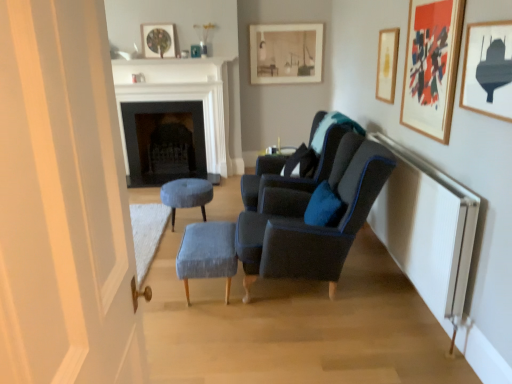
The image size is (512, 384). What do you see at coordinates (426, 229) in the screenshot? I see `white textured radiator at right` at bounding box center [426, 229].

In order to face velvet grey stool at center, arranged as the second stool when viewed from the front, should I rotate leftwards or rightwards?

To face it directly, rotate left by 8.953 degrees.

This screenshot has width=512, height=384. What do you see at coordinates (63, 202) in the screenshot? I see `white fabric curtain at left` at bounding box center [63, 202].

The image size is (512, 384). What do you see at coordinates (184, 99) in the screenshot?
I see `white marble fireplace at center, which appears as the 1th fireplace when viewed from the front` at bounding box center [184, 99].

At what (x,y) coordinates should I click in order to perform the action: click on gold metallic picture frame at upper right, the 3th picture frame positioned from the back. Please return your answer as a coordinate pair (x, y). Looking at the image, I should click on (387, 64).

In terms of size, does matte black side table at center appear bigger or smaller than matte black picture frame at upper center, which appears as the 1th picture frame when viewed from the left?

matte black side table at center is bigger than matte black picture frame at upper center, which appears as the 1th picture frame when viewed from the left.

Is matte black picture frame at upper center, which is the 2th picture frame in back-to-front order, inside matte black side table at center?

Actually, matte black picture frame at upper center, which is the 2th picture frame in back-to-front order, is outside matte black side table at center.

Which point is more forward, (x=267, y=168) or (x=160, y=39)?

The point (x=267, y=168) is closer.

From a real-world perspective, between matte black side table at center and matte black picture frame at upper center, which ranks as the fourth picture frame in front-to-back order, who is vertically lower?

matte black side table at center is physically lower.

Could you measure the distance between velvet dark blue armchair at center, positioned as the 1th chair in back-to-front order, and white marble fireplace at center, which appears as the 1th fireplace when viewed from the front?

Result: velvet dark blue armchair at center, positioned as the 1th chair in back-to-front order, is 2.26 meters away from white marble fireplace at center, which appears as the 1th fireplace when viewed from the front.

Is point (255, 199) closer to camera compared to point (131, 93)?

Yes, point (255, 199) is closer to viewer.

Is the depth of velvet dark blue armchair at center, marked as the 2th chair in a front-to-back arrangement, greater than that of white marble fireplace at center, which appears as the 1th fireplace when viewed from the front?

No, velvet dark blue armchair at center, marked as the 2th chair in a front-to-back arrangement, is closer to the viewer.

Consider the image. From a real-world perspective, between velvet dark blue armchair at center, marked as the 2th chair in a front-to-back arrangement, and white marble fireplace at center, which appears as the 1th fireplace when viewed from the front, who is vertically lower?

velvet dark blue armchair at center, marked as the 2th chair in a front-to-back arrangement, is physically lower.

Is matte gold picture frame at upper right, placed as the fourth picture frame when sorted from left to right, turned away from velvet dark blue armchair at center, arranged as the 1th chair when viewed from the front?

No.

Is matte gold picture frame at upper right, the fourth picture frame when ordered from back to front, bigger than velvet dark blue armchair at center, arranged as the 1th chair when viewed from the front?

No, matte gold picture frame at upper right, the fourth picture frame when ordered from back to front, is not bigger than velvet dark blue armchair at center, arranged as the 1th chair when viewed from the front.

Between matte gold picture frame at upper right, acting as the second picture frame starting from the right, and velvet dark blue armchair at center, the 2th chair in the back-to-front sequence, which one has less height?

With less height is matte gold picture frame at upper right, acting as the second picture frame starting from the right.

Which chair is the 1st one when counting from the left side of the matte gold picture frame at upper right, acting as the second picture frame starting from the right? Please provide its 2D coordinates.

[(308, 225)]

Considering the positions of objects velvet grey stool at center, arranged as the second stool when viewed from the front, and white marble fireplace at center, which appears as the 1th fireplace when viewed from the front, in the image provided, who is more to the right, velvet grey stool at center, arranged as the second stool when viewed from the front, or white marble fireplace at center, which appears as the 1th fireplace when viewed from the front,?

From the viewer's perspective, velvet grey stool at center, arranged as the second stool when viewed from the front, appears more on the right side.

Considering the sizes of velvet grey stool at center, arranged as the second stool when viewed from the front, and white marble fireplace at center, the 2th fireplace in the back-to-front sequence, in the image, is velvet grey stool at center, arranged as the second stool when viewed from the front, taller or shorter than white marble fireplace at center, the 2th fireplace in the back-to-front sequence,?

velvet grey stool at center, arranged as the second stool when viewed from the front, is shorter than white marble fireplace at center, the 2th fireplace in the back-to-front sequence.

Identify the location of the 2nd fireplace above when counting from the velvet grey stool at center, arranged as the first stool when viewed from the back (from the image's perspective). (184, 99).

From the image's perspective, is velvet grey stool at center, arranged as the second stool when viewed from the front, beneath white marble fireplace at center, which appears as the 1th fireplace when viewed from the front?

Yes, from the image's perspective, velvet grey stool at center, arranged as the second stool when viewed from the front, is beneath white marble fireplace at center, which appears as the 1th fireplace when viewed from the front.

Does point (190, 178) come farther from viewer compared to point (490, 93)?

Yes, it is.

Does velvet grey stool at center, arranged as the first stool when viewed from the back, have a larger size compared to matte black submarine at upper right, which is the 5th picture frame from left to right?

Indeed, velvet grey stool at center, arranged as the first stool when viewed from the back, has a larger size compared to matte black submarine at upper right, which is the 5th picture frame from left to right.

How many degrees apart are the facing directions of velvet grey stool at center, arranged as the first stool when viewed from the back, and matte black submarine at upper right, the 1th picture frame viewed from the front?

0.00397 degrees separate the facing orientations of velvet grey stool at center, arranged as the first stool when viewed from the back, and matte black submarine at upper right, the 1th picture frame viewed from the front.

From the image's perspective, which is above, velvet grey stool at center, arranged as the second stool when viewed from the front, or matte black submarine at upper right, acting as the fifth picture frame starting from the back?

matte black submarine at upper right, acting as the fifth picture frame starting from the back.

Based on the photo, can you confirm if gold metallic picture frame at upper right, which is counted as the 3th picture frame, starting from the right, is taller than velvet dark blue armchair at center, the 2th chair in the back-to-front sequence?

In fact, gold metallic picture frame at upper right, which is counted as the 3th picture frame, starting from the right, may be shorter than velvet dark blue armchair at center, the 2th chair in the back-to-front sequence.

Locate an element on the screen. This screenshot has height=384, width=512. the 3rd picture frame positioned above the velvet dark blue armchair at center, arranged as the 1th chair when viewed from the front (from the image's perspective) is located at coordinates (387, 64).

From the image's perspective, which object appears higher, gold metallic picture frame at upper right, the 3th picture frame positioned from the back, or velvet dark blue armchair at center, the 2th chair in the back-to-front sequence?

gold metallic picture frame at upper right, the 3th picture frame positioned from the back, appears higher in the image.

Would you consider gold metallic picture frame at upper right, the 3th picture frame when ordered from left to right, to be distant from velvet dark blue armchair at center, the 2th chair in the back-to-front sequence?

That's right, there is a large distance between gold metallic picture frame at upper right, the 3th picture frame when ordered from left to right, and velvet dark blue armchair at center, the 2th chair in the back-to-front sequence.

From the image's perspective, who appears lower, white fabric curtain at left or velvet dark blue armchair at center, marked as the 2th chair in a front-to-back arrangement?

white fabric curtain at left.

Between point (11, 6) and point (322, 124), which one is positioned behind?

The point (322, 124) is behind.

Consider the image. Would you say white fabric curtain at left is to the left or to the right of velvet dark blue armchair at center, positioned as the 1th chair in back-to-front order, in the picture?

From the image, it's evident that white fabric curtain at left is to the left of velvet dark blue armchair at center, positioned as the 1th chair in back-to-front order.

What are the coordinates of `side table below the matte black picture frame at upper center, which appears as the 1th picture frame when viewed from the left (from a real-world perspective)` in the screenshot? It's located at (273, 160).

Identify the location of the 1st chair in front of the white marble fireplace at center, which appears as the 1th fireplace when viewed from the front. This screenshot has width=512, height=384. (307, 159).

Consider the image. Based on their spatial positions, is white marble fireplace at center, which appears as the 1th fireplace when viewed from the front, or white fabric curtain at left further from matte gold picture frame at upper right, placed as the fourth picture frame when sorted from left to right?

Among the two, white marble fireplace at center, which appears as the 1th fireplace when viewed from the front, is located further to matte gold picture frame at upper right, placed as the fourth picture frame when sorted from left to right.

Based on their spatial positions, is white marble fireplace at center, which appears as the 1th fireplace when viewed from the front, or gold metallic picture frame at upper right, the 3th picture frame positioned from the back, closer to white fabric curtain at left?

gold metallic picture frame at upper right, the 3th picture frame positioned from the back, is positioned closer to the anchor white fabric curtain at left.

Looking at the image, which one is located further to velvet grey stool at center, arranged as the first stool when viewed from the back, velvet dark blue armchair at center, the 2th chair in the back-to-front sequence, or matte paper picture frame at upper center, the first picture frame positioned from the back?

matte paper picture frame at upper center, the first picture frame positioned from the back, is positioned further to the anchor velvet grey stool at center, arranged as the first stool when viewed from the back.

Based on their spatial positions, is matte paper picture frame at upper center, which appears as the second picture frame when viewed from the left, or light blue fabric stool at center, positioned as the 1th stool in front-to-back order, further from matte black submarine at upper right, the 1th picture frame viewed from the front?

matte paper picture frame at upper center, which appears as the second picture frame when viewed from the left, is positioned further to the anchor matte black submarine at upper right, the 1th picture frame viewed from the front.

Looking at the image, which one is located closer to matte paper picture frame at upper center, the first picture frame positioned from the back, matte black submarine at upper right, which appears as the 1th picture frame when viewed from the right, or velvet dark blue armchair at center, marked as the 2th chair in a front-to-back arrangement?

velvet dark blue armchair at center, marked as the 2th chair in a front-to-back arrangement, is positioned closer to the anchor matte paper picture frame at upper center, the first picture frame positioned from the back.

Considering their positions, is light blue fabric stool at center, which is counted as the 2th stool, starting from the back, positioned further to white marble fireplace at center, which appears as the 1th fireplace when viewed from the front, than velvet dark blue armchair at center, arranged as the 1th chair when viewed from the front?

light blue fabric stool at center, which is counted as the 2th stool, starting from the back, is further to white marble fireplace at center, which appears as the 1th fireplace when viewed from the front.

When comparing their distances from white fabric curtain at left, does matte paper picture frame at upper center, which appears as the second picture frame when viewed from the left, or white marble fireplace at center, the 2th fireplace in the back-to-front sequence, seem further?

matte paper picture frame at upper center, which appears as the second picture frame when viewed from the left, lies further to white fabric curtain at left than the other object.

Looking at the image, which one is located further to matte black side table at center, velvet dark blue armchair at center, the 2th chair in the back-to-front sequence, or velvet grey stool at center, arranged as the first stool when viewed from the back?

Based on the image, velvet dark blue armchair at center, the 2th chair in the back-to-front sequence, appears to be further to matte black side table at center.

Where is `chair between white fabric curtain at left and light blue fabric stool at center, positioned as the 1th stool in front-to-back order, in the front-back direction`? chair between white fabric curtain at left and light blue fabric stool at center, positioned as the 1th stool in front-to-back order, in the front-back direction is located at coordinates (308, 225).

Locate an element on the screen. This screenshot has width=512, height=384. side table between matte black submarine at upper right, acting as the fifth picture frame starting from the back, and matte paper picture frame at upper center, the fourth picture frame in the right-to-left sequence, from front to back is located at coordinates (273, 160).

Where is `picture frame between velvet dark blue armchair at center, marked as the 2th chair in a front-to-back arrangement, and dark gray stone fireplace at center, which appears as the 1th fireplace when viewed from the back, in the front-back direction`? This screenshot has width=512, height=384. picture frame between velvet dark blue armchair at center, marked as the 2th chair in a front-to-back arrangement, and dark gray stone fireplace at center, which appears as the 1th fireplace when viewed from the back, in the front-back direction is located at coordinates (158, 40).

At what (x,y) coordinates should I click in order to perform the action: click on picture frame between white fabric curtain at left and matte gold picture frame at upper right, placed as the fourth picture frame when sorted from left to right, from front to back. Please return your answer as a coordinate pair (x, y). Looking at the image, I should click on (488, 70).